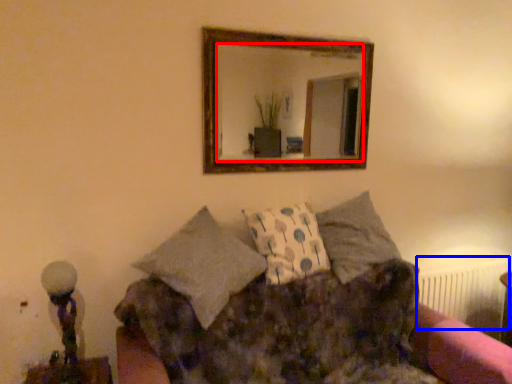
Question: Among these objects, which one is farthest to the camera, mirror (highlighted by a red box) or radiator (highlighted by a blue box)?

Choices:
 (A) mirror
 (B) radiator

Answer: (B)